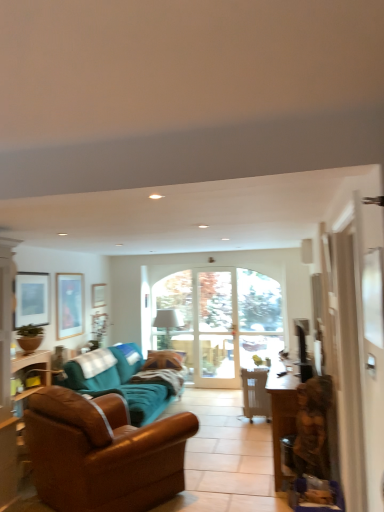
Question: In which direction should I rotate to look at teal fabric couch at center, which is counted as the first studio couch, starting from the back?

Choices:
 (A) left
 (B) right

Answer: (A)

Question: Can you confirm if white fabric lampshade at center is thinner than clear glass door at center?

Choices:
 (A) no
 (B) yes

Answer: (A)

Question: Can you confirm if white fabric lampshade at center is taller than clear glass door at center?

Choices:
 (A) no
 (B) yes

Answer: (A)

Question: From a real-world perspective, is white fabric lampshade at center over clear glass door at center?

Choices:
 (A) no
 (B) yes

Answer: (A)

Question: Can you confirm if white fabric lampshade at center is shorter than clear glass door at center?

Choices:
 (A) yes
 (B) no

Answer: (A)

Question: Is white fabric lampshade at center to the left of clear glass door at center from the viewer's perspective?

Choices:
 (A) no
 (B) yes

Answer: (B)

Question: From the image's perspective, is white fabric lampshade at center below clear glass door at center?

Choices:
 (A) yes
 (B) no

Answer: (A)

Question: Does clear glass door at center appear on the right side of satin black television at right?

Choices:
 (A) yes
 (B) no

Answer: (B)

Question: From the image's perspective, would you say clear glass door at center is positioned over satin black television at right?

Choices:
 (A) yes
 (B) no

Answer: (B)

Question: Considering the relative sizes of clear glass door at center and satin black television at right in the image provided, is clear glass door at center smaller than satin black television at right?

Choices:
 (A) yes
 (B) no

Answer: (B)

Question: Considering the relative positions of clear glass door at center and satin black television at right in the image provided, is clear glass door at center behind satin black television at right?

Choices:
 (A) yes
 (B) no

Answer: (A)

Question: Is clear glass door at center far from satin black television at right?

Choices:
 (A) no
 (B) yes

Answer: (B)

Question: Is clear glass door at center facing away from satin black television at right?

Choices:
 (A) yes
 (B) no

Answer: (B)

Question: From a real-world perspective, is matte black picture frame at upper left, the 1th picture frame in the left-to-right sequence, on top of teal fabric couch at center, which is counted as the first studio couch, starting from the back?

Choices:
 (A) yes
 (B) no

Answer: (A)